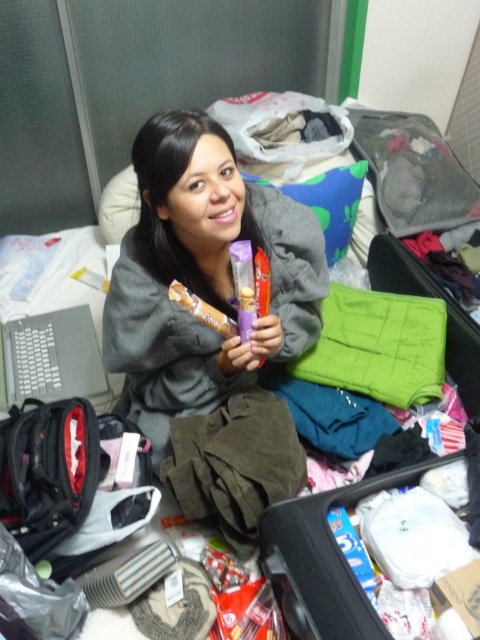
Question: Does green quilted bag at center have a greater width compared to silver metallic laptop at left?

Choices:
 (A) no
 (B) yes

Answer: (B)

Question: Considering the real-world distances, which object is closest to the green quilted suitcase at center-right?

Choices:
 (A) silver metallic laptop at left
 (B) blue fabric pillow at upper center

Answer: (B)

Question: In this image, where is gray soft sweater at center located relative to green quilted suitcase at center-right?

Choices:
 (A) above
 (B) below

Answer: (B)

Question: From the image, what is the correct spatial relationship of green quilted bag at center in relation to blue fabric pillow at upper center?

Choices:
 (A) below
 (B) above

Answer: (A)

Question: Estimate the real-world distances between objects in this image. Which object is farther from the green quilted blanket at center?

Choices:
 (A) green quilted suitcase at center-right
 (B) blue fabric pillow at upper center

Answer: (B)

Question: Which object is farther from the camera taking this photo?

Choices:
 (A) green quilted blanket at center
 (B) gray soft sweater at center
 (C) green quilted bag at center

Answer: (A)